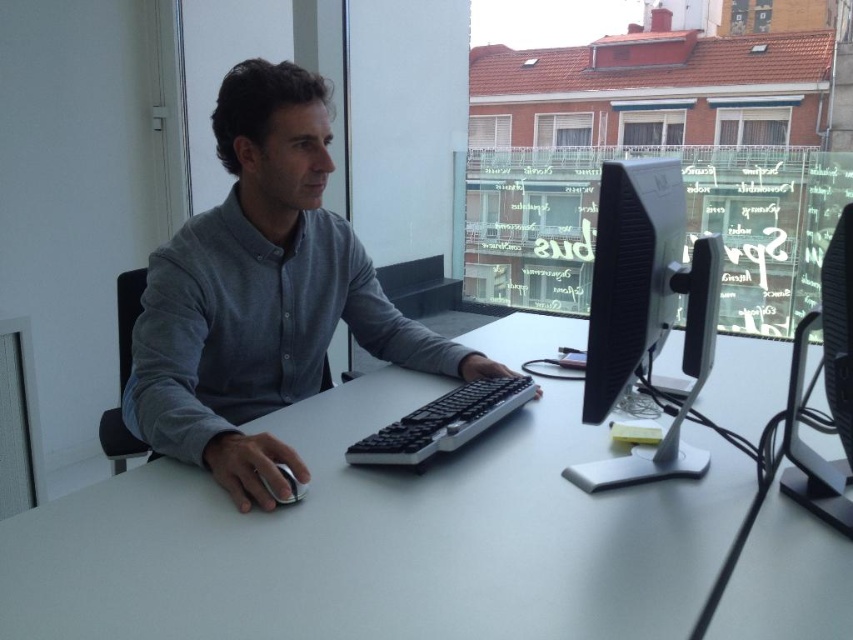
Question: Which of the following is the farthest from the observer?

Choices:
 (A) satin black monitor at center
 (B) black plastic keyboard at center
 (C) gray matte shirt at center
 (D) white matte table at center

Answer: (B)

Question: Is white matte table at center in front of satin black monitor at center?

Choices:
 (A) no
 (B) yes

Answer: (B)

Question: Does gray matte shirt at center appear on the right side of black plastic keyboard at center?

Choices:
 (A) no
 (B) yes

Answer: (A)

Question: Based on their relative distances, which object is farther from the satin black monitor at center?

Choices:
 (A) black plastic keyboard at center
 (B) white glossy mouse at lower left
 (C) white matte table at center
 (D) gray matte shirt at center

Answer: (B)

Question: In this image, where is satin black monitor at center located relative to black plastic keyboard at center?

Choices:
 (A) right
 (B) left

Answer: (A)

Question: Considering the real-world distances, which object is farthest from the black plastic keyboard at center?

Choices:
 (A) gray matte shirt at center
 (B) white matte table at center
 (C) white glossy mouse at lower left
 (D) satin black monitor at center

Answer: (A)